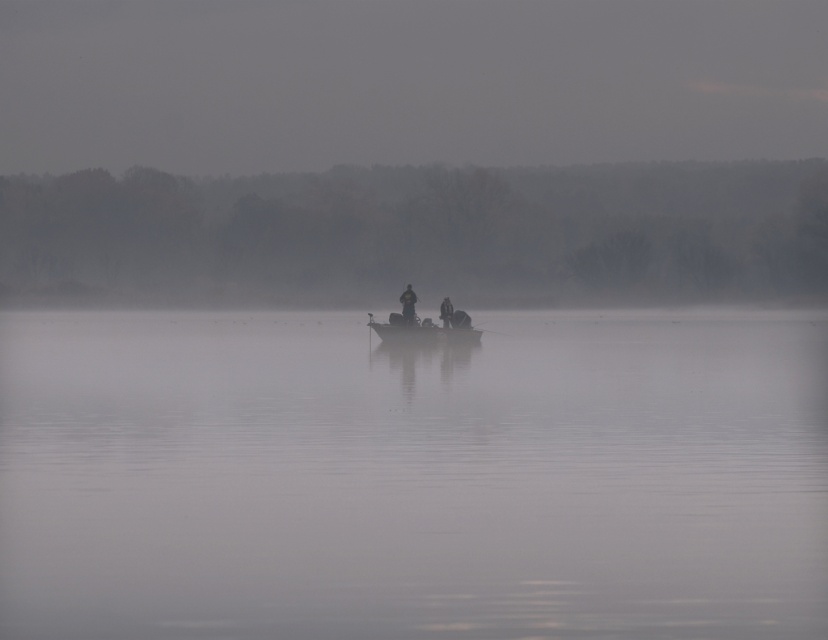
You are on a boat in the middle of a foggy lake. You notice the transparent misty water at center and the dark gray jacket at center. Which object is closer to the water surface?

The dark gray jacket at center is closer to the water surface because the transparent misty water at center is located below it.

You are a boat operator who needs to navigate through the transparent misty water at center and the metallic gray boat at center. What is the minimum distance you should maintain between the boat and the water to avoid collision?

The distance between the transparent misty water at center and the metallic gray boat at center is 14.35 meters, so maintaining at least 14.35 meters would prevent collision.

You are a drone operator trying to locate the metallic gray boat at center in a foggy lake scene. According to the coordinates provided, where would you direct the drone to find it?

The metallic gray boat at center is located at coordinates point (424, 330).